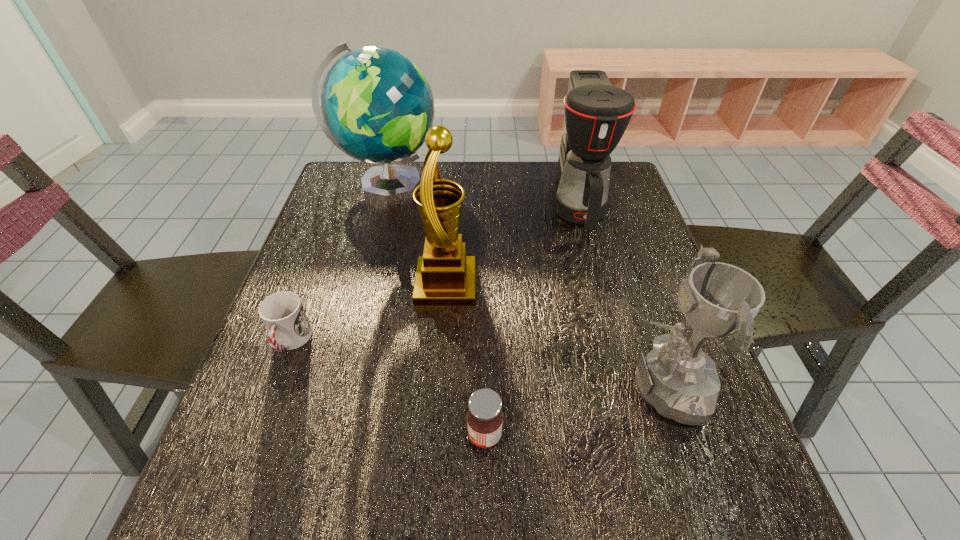
The image size is (960, 540). What are the coordinates of `free region located pour from the carafe of the coffee maker` in the screenshot? It's located at (603, 296).

Identify the location of free location located 0.250m on the side with emblem of the shorter award. (469, 386).

What are the coordinates of `vacant region located on the side with emblem of the shorter award` in the screenshot? It's located at (410, 386).

This screenshot has height=540, width=960. Find the location of `vacant space located on the side with emblem of the shorter award`. vacant space located on the side with emblem of the shorter award is located at coordinates (529, 386).

Where is `free space located 0.170m on the label side of the second shortest object`? This screenshot has height=540, width=960. free space located 0.170m on the label side of the second shortest object is located at coordinates (368, 435).

Locate an element on the screen. free space located 0.340m on the label side of the second shortest object is located at coordinates (267, 435).

Locate an element on the screen. free space located on the label side of the second shortest object is located at coordinates (267, 435).

Identify the location of vacant area situated on the side of the shortest object where the handle is located. The height and width of the screenshot is (540, 960). (228, 510).

This screenshot has width=960, height=540. In order to click on globe located at the far edge in this screenshot , I will do `click(376, 106)`.

Identify the location of coffee maker situated at the far edge. (597, 114).